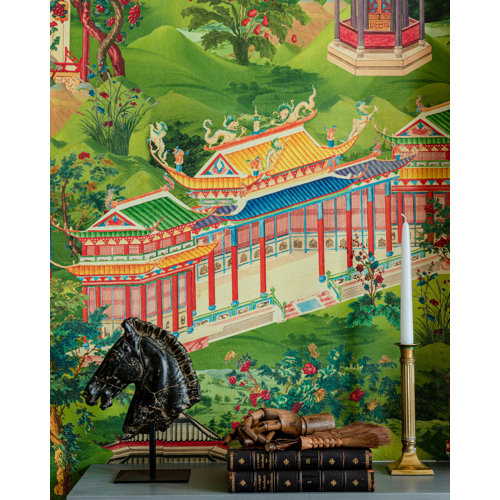
Locate an element on the screen. back left corner of candle base is located at coordinates (386, 465).